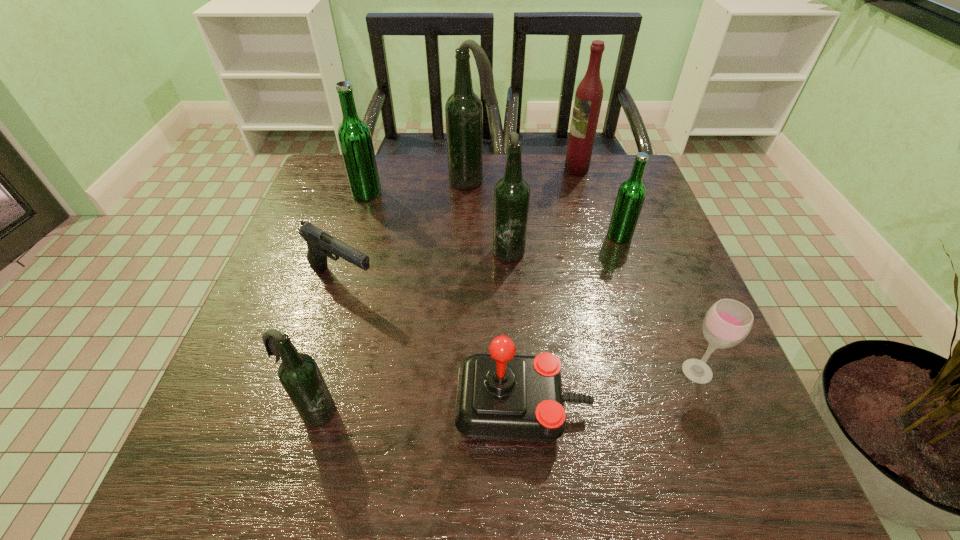
I want to click on red joystick, so click(501, 396).

This screenshot has height=540, width=960. Identify the location of wineglass. (727, 322).

The width and height of the screenshot is (960, 540). I want to click on gun, so click(x=320, y=244).

Locate an element on the screen. This screenshot has height=540, width=960. the shortest object is located at coordinates (320, 244).

Find the location of a particular element. The width and height of the screenshot is (960, 540). free space located 0.130m on the left of the farthest dark beer bottle is located at coordinates (403, 181).

This screenshot has height=540, width=960. Find the location of `free space located 0.400m on the label of the liquor`. free space located 0.400m on the label of the liquor is located at coordinates (428, 169).

The height and width of the screenshot is (540, 960). I want to click on free location located on the label of the liquor, so click(530, 169).

Locate an element on the screen. vacant space located on the label of the liquor is located at coordinates (503, 169).

I want to click on vacant space located 0.050m on the back of the left green beer bottle, so click(372, 175).

Where is `free space located 0.110m on the left of the second farthest dark beer bottle`? free space located 0.110m on the left of the second farthest dark beer bottle is located at coordinates (446, 248).